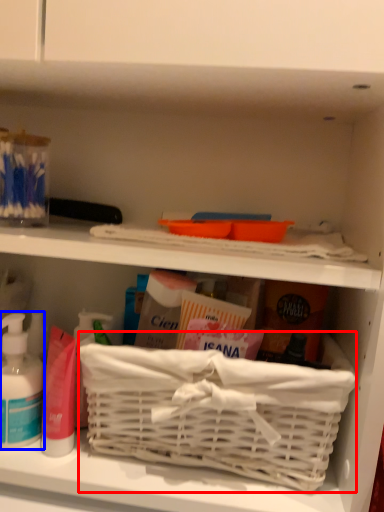
Question: Which point is closer to the camera, basket container (highlighted by a red box) or cleaning product (highlighted by a blue box)?

Choices:
 (A) basket container
 (B) cleaning product

Answer: (A)